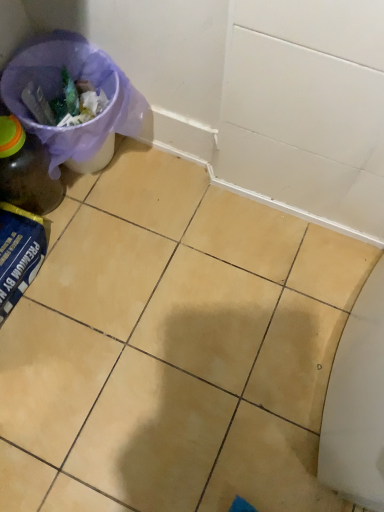
Measure the distance between point [234,294] and camera.

They are 1.09 meters apart.

Describe the element at coordinates (26, 170) in the screenshot. I see `matte glass bottle at left` at that location.

Identify the location of matte glass bottle at left. (26, 170).

Measure the distance between purple fabric bag at upper left and camera.

The depth of purple fabric bag at upper left is 39.25 inches.

What do you see at coordinates (60, 91) in the screenshot?
I see `purple fabric bag at upper left` at bounding box center [60, 91].

The image size is (384, 512). Find the location of `yellow matte tile at center`. yellow matte tile at center is located at coordinates (173, 348).

Is yellow matte tile at center bigger or smaller than matte glass bottle at left?

In the image, yellow matte tile at center appears to be larger than matte glass bottle at left.

From the image's perspective, which one is positioned lower, yellow matte tile at center or matte glass bottle at left?

yellow matte tile at center is shown below in the image.

Is yellow matte tile at center shorter than matte glass bottle at left?

Correct, yellow matte tile at center is not as tall as matte glass bottle at left.

Does yellow matte tile at center touch matte glass bottle at left?

yellow matte tile at center and matte glass bottle at left are clearly separated.

In the scene shown: How many degrees apart are the facing directions of purple fabric bag at upper left and matte glass bottle at left?

3.3 degrees separate the facing orientations of purple fabric bag at upper left and matte glass bottle at left.

From a real-world perspective, is purple fabric bag at upper left located beneath matte glass bottle at left?

Yes, from a real-world perspective, purple fabric bag at upper left is under matte glass bottle at left.

Does point (99, 141) come closer to viewer compared to point (59, 183)?

Yes, it is in front of point (59, 183).

Consider the image. Is yellow matte tile at center completely or partially inside purple fabric bag at upper left?

No.

Which object is further away from the camera, purple fabric bag at upper left or yellow matte tile at center?

Positioned behind is purple fabric bag at upper left.

Looking at this image, from the image's perspective, relative to yellow matte tile at center, is purple fabric bag at upper left above or below?

purple fabric bag at upper left is situated higher than yellow matte tile at center in the image.

The height and width of the screenshot is (512, 384). Identify the location of bottle in front of the purple fabric bag at upper left. (26, 170).

Is matte glass bottle at left wider or thinner than purple fabric bag at upper left?

Clearly, matte glass bottle at left has less width compared to purple fabric bag at upper left.

Which is in front, point (51, 189) or point (9, 95)?

Point (9, 95)

From the image's perspective, between matte glass bottle at left and purple fabric bag at upper left, which one is located above?

purple fabric bag at upper left appears higher in the image.

How distant is yellow matte tile at center from purple fabric bag at upper left?

The distance of yellow matte tile at center from purple fabric bag at upper left is 16.16 inches.

From the image's perspective, who appears lower, yellow matte tile at center or purple fabric bag at upper left?

yellow matte tile at center, from the image's perspective.

Considering their positions, is yellow matte tile at center located in front of or behind purple fabric bag at upper left?

Result: Visually, yellow matte tile at center is located in front of purple fabric bag at upper left.

Is yellow matte tile at center oriented towards purple fabric bag at upper left?

No, yellow matte tile at center is not aimed at purple fabric bag at upper left.

Which object is further away from the camera, matte glass bottle at left or yellow matte tile at center?

matte glass bottle at left is behind.

Between matte glass bottle at left and yellow matte tile at center, which one has smaller size?

matte glass bottle at left is smaller.

Where is `ceramic tile on the right of matte glass bottle at left`? ceramic tile on the right of matte glass bottle at left is located at coordinates (173, 348).

Locate an element on the screen. This screenshot has height=512, width=384. bottle located on the left of yellow matte tile at center is located at coordinates (26, 170).

In the image, there is a purple fabric bag at upper left. In order to click on bottle below it (from the image's perspective) in this screenshot , I will do `click(26, 170)`.

Estimate the real-world distances between objects in this image. Which object is closer to yellow matte tile at center, purple fabric bag at upper left or matte glass bottle at left?

purple fabric bag at upper left lies closer to yellow matte tile at center than the other object.

Estimate the real-world distances between objects in this image. Which object is further from matte glass bottle at left, purple fabric bag at upper left or yellow matte tile at center?

Based on the image, yellow matte tile at center appears to be further to matte glass bottle at left.

Looking at the image, which one is located further to yellow matte tile at center, matte glass bottle at left or purple fabric bag at upper left?

Based on the image, matte glass bottle at left appears to be further to yellow matte tile at center.

Estimate the real-world distances between objects in this image. Which object is further from purple fabric bag at upper left, yellow matte tile at center or matte glass bottle at left?

The object further to purple fabric bag at upper left is yellow matte tile at center.

Looking at the image, which one is located closer to purple fabric bag at upper left, matte glass bottle at left or yellow matte tile at center?

Based on the image, matte glass bottle at left appears to be nearer to purple fabric bag at upper left.

Based on their spatial positions, is yellow matte tile at center or purple fabric bag at upper left closer to matte glass bottle at left?

purple fabric bag at upper left lies closer to matte glass bottle at left than the other object.

The height and width of the screenshot is (512, 384). What are the coordinates of `bottle between purple fabric bag at upper left and yellow matte tile at center in the up-down direction` in the screenshot? It's located at (26, 170).